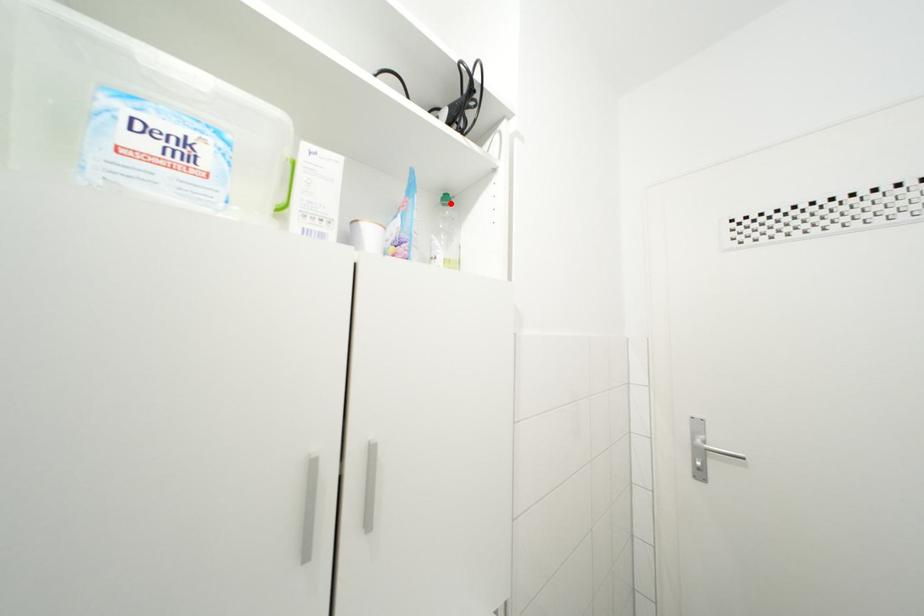
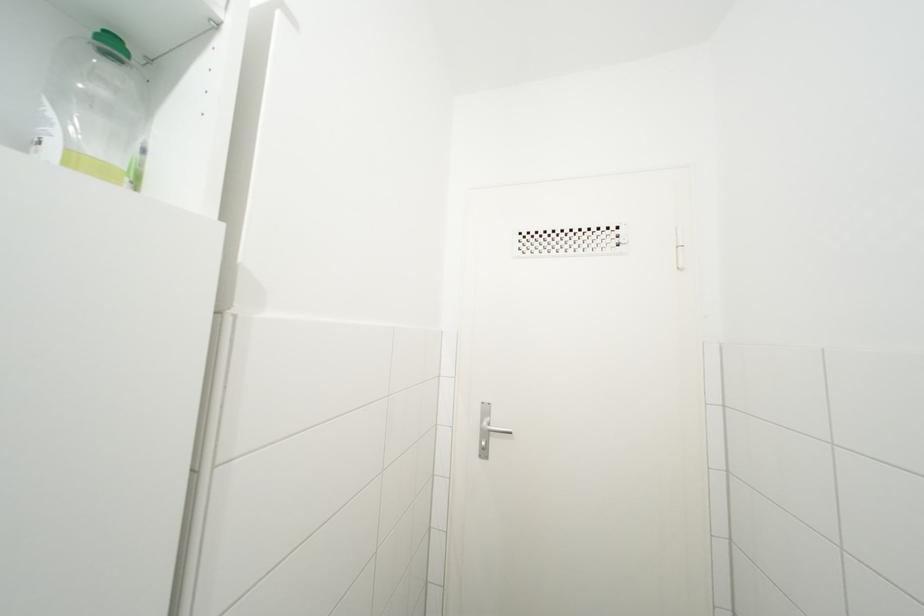
In the second image, find the point that corresponds to the highlighted location in the first image.

(117, 51)